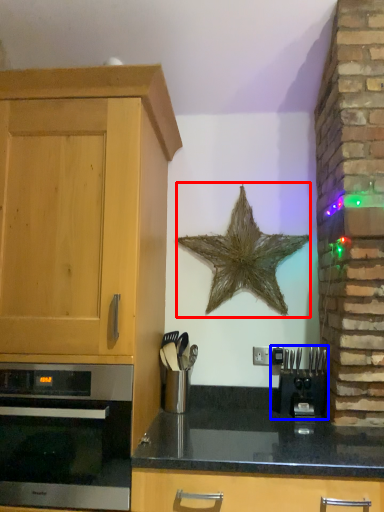
Question: Which object is closer to the camera taking this photo, starfish (highlighted by a red box) or coffee machine (highlighted by a blue box)?

Choices:
 (A) starfish
 (B) coffee machine

Answer: (B)